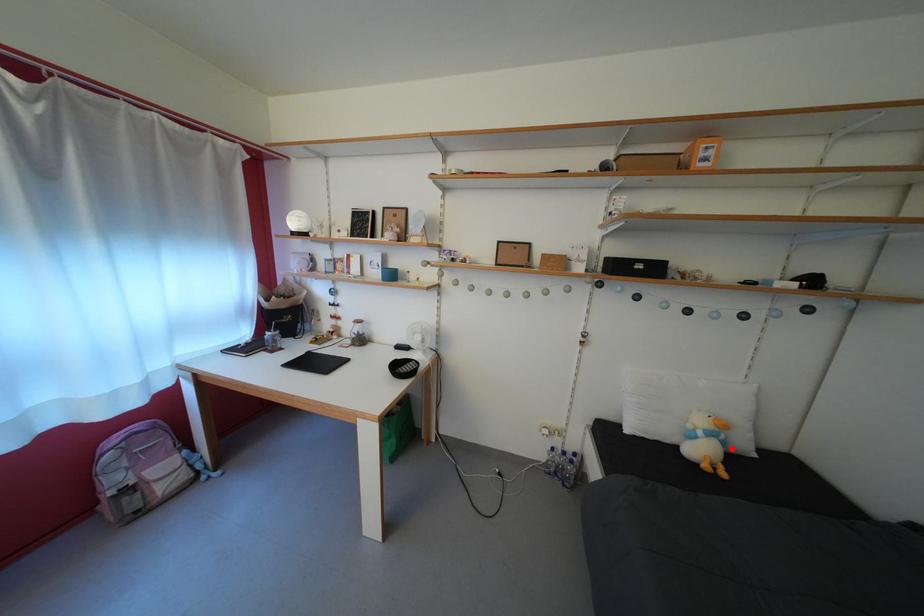
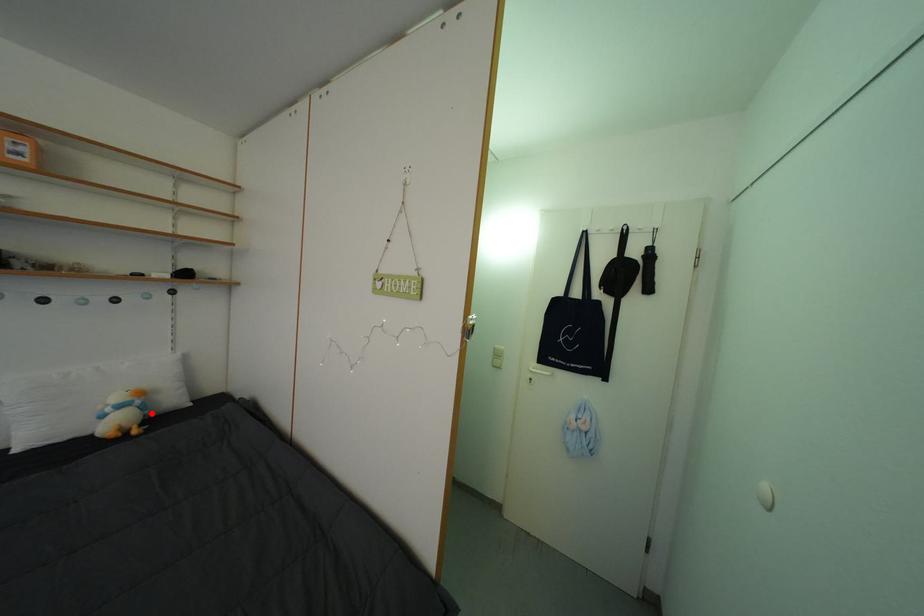
I am providing you with two images of the same scene from different viewpoints. A red point is marked on the first image and another point is marked on the second image. Are the points marked in image1 and image2 representing the same 3D position?

Yes